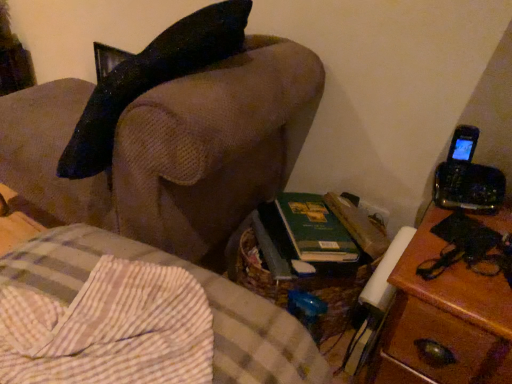
In order to click on wooden nightstand at right in this screenshot , I will do `click(450, 304)`.

Considering the positions of points (139, 252) and (266, 47), is point (139, 252) closer to camera compared to point (266, 47)?

Yes, point (139, 252) is in front of point (266, 47).

Relative to brown fabric couch at upper left, the 1th furniture positioned from the top, is brown woven basket at lower center, the second furniture from the top, in front or behind?

brown woven basket at lower center, the second furniture from the top, is positioned closer to the viewer than brown fabric couch at upper left, the 1th furniture positioned from the top.

Is brown woven basket at lower center, the second furniture from the top, turned away from brown fabric couch at upper left, the 1th furniture positioned from the top?

brown woven basket at lower center, the second furniture from the top, is not turned away from brown fabric couch at upper left, the 1th furniture positioned from the top.

Is the position of wooden nightstand at right less distant than that of brown woven basket at lower center, placed as the 1th furniture when sorted from bottom to top?

That is False.

Considering the relative sizes of wooden nightstand at right and brown woven basket at lower center, the second furniture from the top, in the image provided, is wooden nightstand at right shorter than brown woven basket at lower center, the second furniture from the top,?

Yes, wooden nightstand at right is shorter than brown woven basket at lower center, the second furniture from the top.

Which point is more forward, (468, 292) or (57, 379)?

The point (57, 379) is closer.

Between wooden nightstand at right and brown woven basket at lower center, placed as the 1th furniture when sorted from bottom to top, which one appears on the right side from the viewer's perspective?

Positioned to the right is wooden nightstand at right.

From the image's perspective, between brown woven basket at lower center, the second furniture from the top, and wooden nightstand at right, who is located below?

brown woven basket at lower center, the second furniture from the top, is shown below in the image.

From the wooden nightstand at right, count the 1st furniture to the left and point to it. Please provide its 2D coordinates.

[(138, 319)]

Which is farther, [244,298] or [467,269]?

The point [467,269] is more distant.

Between brown woven basket at lower center, the second furniture from the top, and wooden nightstand at right, which one has smaller size?

Smaller between the two is wooden nightstand at right.

Is there a large distance between wooden nightstand at right and brown fabric couch at upper left, the second furniture in the bottom-to-top sequence?

No, wooden nightstand at right is not far away from brown fabric couch at upper left, the second furniture in the bottom-to-top sequence.

How distant is wooden nightstand at right from brown fabric couch at upper left, the 1th furniture positioned from the top?

21.78 inches.

From the image's perspective, which object appears higher, wooden nightstand at right or brown fabric couch at upper left, the second furniture in the bottom-to-top sequence?

brown fabric couch at upper left, the second furniture in the bottom-to-top sequence, is shown above in the image.

Can you confirm if wooden nightstand at right is bigger than brown fabric couch at upper left, the second furniture in the bottom-to-top sequence?

No.

Visually, is brown fabric couch at upper left, the second furniture in the bottom-to-top sequence, positioned to the left or to the right of wooden nightstand at right?

In the image, brown fabric couch at upper left, the second furniture in the bottom-to-top sequence, appears on the left side of wooden nightstand at right.

Is brown fabric couch at upper left, the 1th furniture positioned from the top, further to camera compared to wooden nightstand at right?

No, brown fabric couch at upper left, the 1th furniture positioned from the top, is closer to the viewer.

Which is correct: brown fabric couch at upper left, the second furniture in the bottom-to-top sequence, is inside wooden nightstand at right, or outside of it?

brown fabric couch at upper left, the second furniture in the bottom-to-top sequence, exists outside the volume of wooden nightstand at right.

Considering the positions of points (129, 175) and (483, 345), is point (129, 175) closer to camera compared to point (483, 345)?

No, (129, 175) is further to viewer.

Is brown fabric couch at upper left, the 1th furniture positioned from the top, looking in the opposite direction of brown woven basket at lower center, placed as the 1th furniture when sorted from bottom to top?

No, brown woven basket at lower center, placed as the 1th furniture when sorted from bottom to top, is not at the back of brown fabric couch at upper left, the 1th furniture positioned from the top.

Between brown fabric couch at upper left, the 1th furniture positioned from the top, and brown woven basket at lower center, the second furniture from the top, which one has smaller width?

brown fabric couch at upper left, the 1th furniture positioned from the top, is thinner.

Where is `furniture to the right of brown fabric couch at upper left, the second furniture in the bottom-to-top sequence`? Image resolution: width=512 pixels, height=384 pixels. furniture to the right of brown fabric couch at upper left, the second furniture in the bottom-to-top sequence is located at coordinates (138, 319).

Considering the positions of objects brown fabric couch at upper left, the 1th furniture positioned from the top, and brown woven basket at lower center, the second furniture from the top, in the image provided, who is more to the right, brown fabric couch at upper left, the 1th furniture positioned from the top, or brown woven basket at lower center, the second furniture from the top,?

brown woven basket at lower center, the second furniture from the top.

Image resolution: width=512 pixels, height=384 pixels. In order to click on furniture below the brown fabric couch at upper left, the second furniture in the bottom-to-top sequence (from a real-world perspective) in this screenshot , I will do `click(138, 319)`.

The height and width of the screenshot is (384, 512). In order to click on nightstand above the brown woven basket at lower center, placed as the 1th furniture when sorted from bottom to top (from a real-world perspective) in this screenshot , I will do `click(450, 304)`.

When comparing their distances from wooden nightstand at right, does brown woven basket at lower center, placed as the 1th furniture when sorted from bottom to top, or brown fabric couch at upper left, the 1th furniture positioned from the top, seem closer?

brown woven basket at lower center, placed as the 1th furniture when sorted from bottom to top, is closer to wooden nightstand at right.

Looking at the image, which one is located further to brown fabric couch at upper left, the 1th furniture positioned from the top, brown woven basket at lower center, placed as the 1th furniture when sorted from bottom to top, or wooden nightstand at right?

Based on the image, wooden nightstand at right appears to be further to brown fabric couch at upper left, the 1th furniture positioned from the top.

Considering their positions, is brown fabric couch at upper left, the second furniture in the bottom-to-top sequence, positioned further to brown woven basket at lower center, placed as the 1th furniture when sorted from bottom to top, than wooden nightstand at right?

A: wooden nightstand at right is further to brown woven basket at lower center, placed as the 1th furniture when sorted from bottom to top.

From the image, which object appears to be farther from wooden nightstand at right, brown fabric couch at upper left, the second furniture in the bottom-to-top sequence, or brown woven basket at lower center, placed as the 1th furniture when sorted from bottom to top?

Based on the image, brown fabric couch at upper left, the second furniture in the bottom-to-top sequence, appears to be further to wooden nightstand at right.

Considering their positions, is wooden nightstand at right positioned further to brown woven basket at lower center, the second furniture from the top, than brown fabric couch at upper left, the second furniture in the bottom-to-top sequence?

Based on the image, wooden nightstand at right appears to be further to brown woven basket at lower center, the second furniture from the top.

Looking at the image, which one is located further to brown fabric couch at upper left, the second furniture in the bottom-to-top sequence, wooden nightstand at right or brown woven basket at lower center, the second furniture from the top?

wooden nightstand at right is further to brown fabric couch at upper left, the second furniture in the bottom-to-top sequence.

Identify the location of furniture situated between brown fabric couch at upper left, the second furniture in the bottom-to-top sequence, and wooden nightstand at right from left to right. [x=138, y=319].